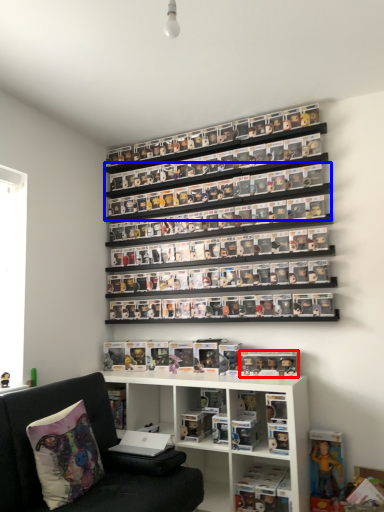
Question: Among these objects, which one is nearest to the camera, toy (highlighted by a red box) or shelf (highlighted by a blue box)?

Choices:
 (A) toy
 (B) shelf

Answer: (A)